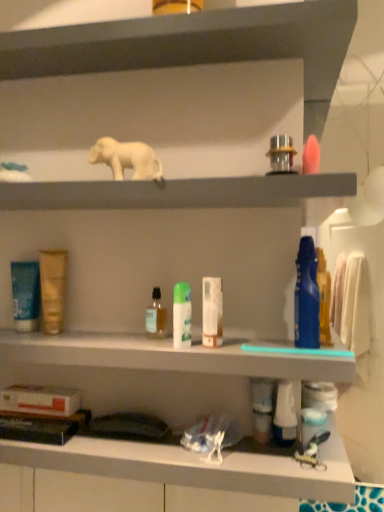
Question: Is point (152, 22) closer or farther from the camera than point (296, 364)?

Choices:
 (A) farther
 (B) closer

Answer: (A)

Question: Looking at the image, does matte gray shelf at upper center, the 2th shelf ordered from the bottom, seem bigger or smaller compared to white plastic bottles at center?

Choices:
 (A) big
 (B) small

Answer: (B)

Question: Which object is the farthest from the matte gold tube at center left, the 6th toiletry positioned from the right?

Choices:
 (A) white matte tube at center, arranged as the 4th toiletry when viewed from the right
 (B) blue glossy mouthwash at center right, which is the 1th mouthwash in right-to-left order
 (C) metallic silver faucet at upper center, the fifth toiletry viewed from the left
 (D) translucent plastic bottle at center, marked as the 1th mouthwash in a back-to-front arrangement
 (E) blue glossy toothpaste at right, which ranks as the 1th toiletry in right-to-left order

Answer: (E)

Question: Estimate the real-world distances between objects in this image. Which object is closer to the matte gray shelf at upper center, the 1th shelf when ordered from top to bottom?

Choices:
 (A) white matte box at lower center
 (B) white matte elephant at upper center
 (C) white matte elephant at upper center, placed as the 1th shelf when sorted from bottom to top
 (D) blue glossy toothpaste at right, which appears as the 7th toiletry when viewed from the left
 (E) metallic silver faucet at upper center, which is counted as the 3th toiletry, starting from the right

Answer: (B)